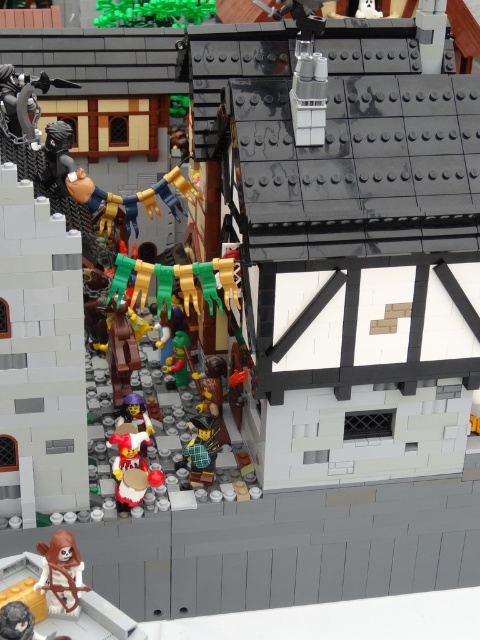
Question: Is green matte bricks at upper center further to the viewer compared to brown matte figure at lower left?

Choices:
 (A) no
 (B) yes

Answer: (B)

Question: Can you confirm if brown matte figure at lower left is bigger than green plaid shirt at center?

Choices:
 (A) yes
 (B) no

Answer: (A)

Question: Which point is closer to the camera?

Choices:
 (A) (204, 436)
 (B) (75, 584)
 (C) (193, 10)

Answer: (B)

Question: Among these objects, which one is farthest from the camera?

Choices:
 (A) green plaid shirt at center
 (B) brown matte figure at lower left
 (C) green matte bricks at upper center

Answer: (C)

Question: Which point is closer to the camera taking this photo?

Choices:
 (A) (84, 589)
 (B) (214, 467)
 (C) (119, 1)

Answer: (A)

Question: Is brown matte figure at lower left positioned before green plaid shirt at center?

Choices:
 (A) no
 (B) yes

Answer: (B)